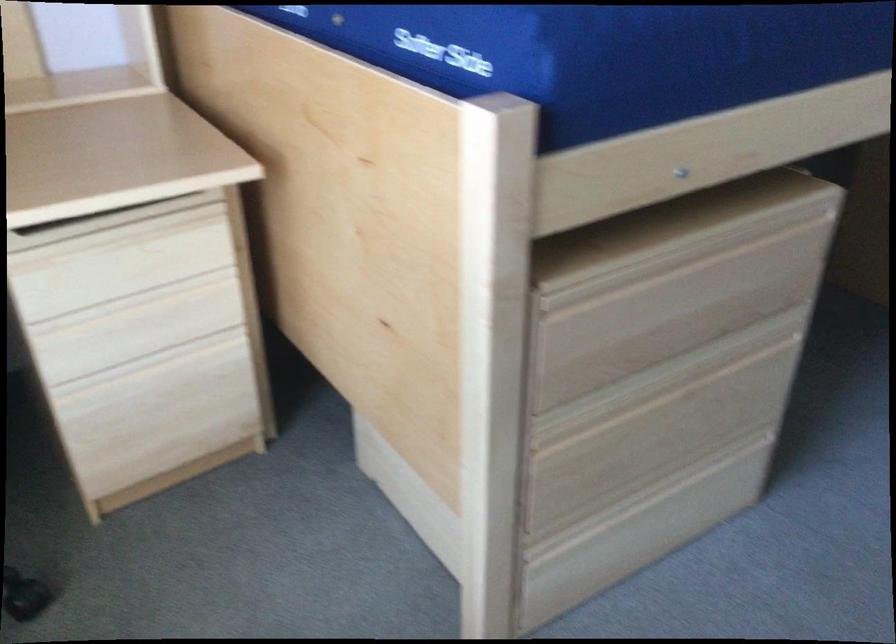
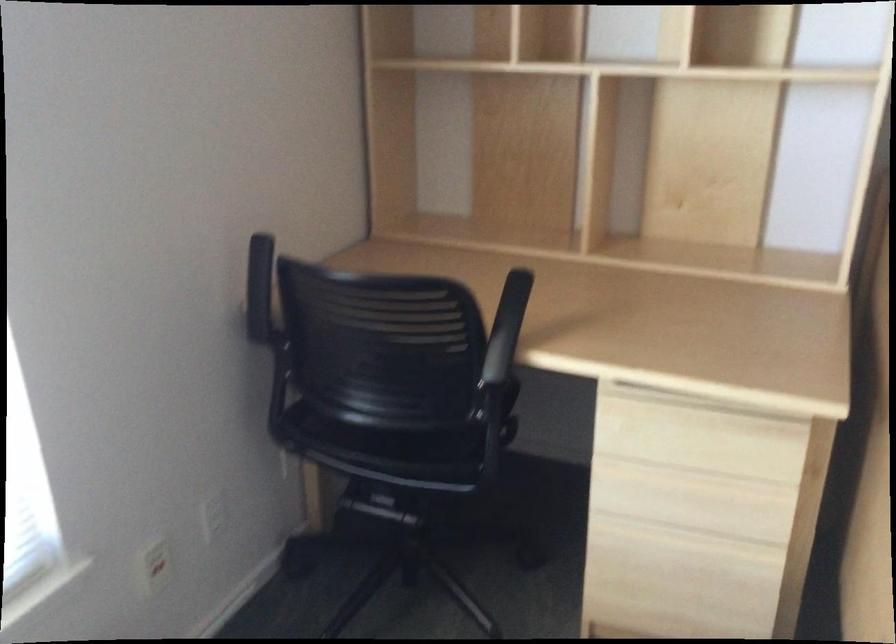
Question: The camera is either moving clockwise (left) or counter-clockwise (right) around the object. The first image is from the beginning of the video and the second image is from the end. Is the camera moving left or right when shooting the video?

Choices:
 (A) Left
 (B) Right

Answer: (B)